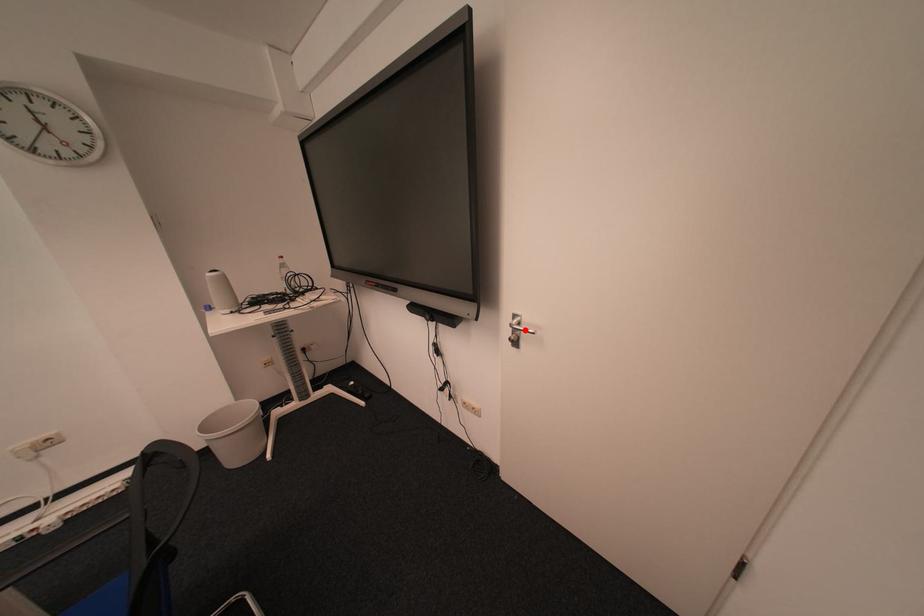
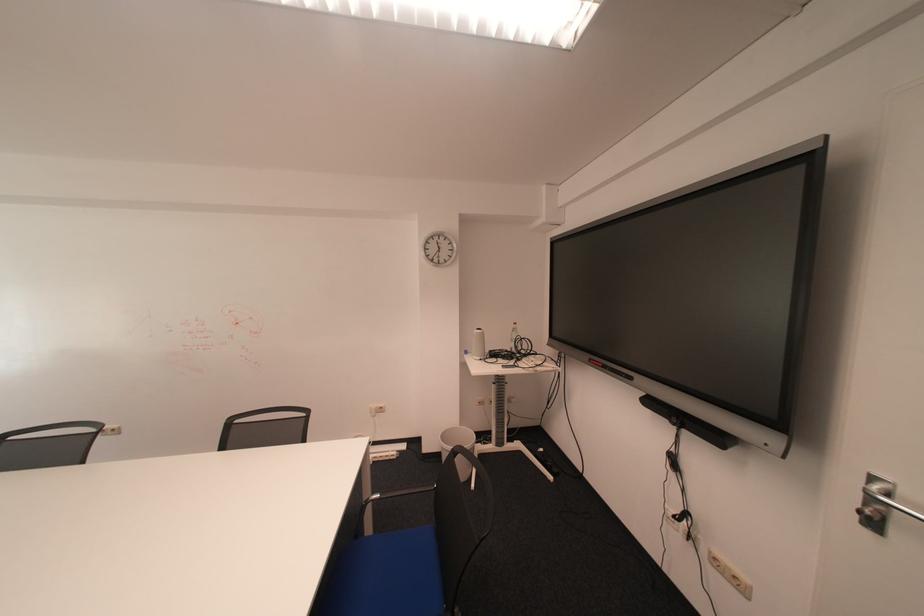
Where in the second image is the point corresponding to the highlighted location from the first image?

(884, 501)